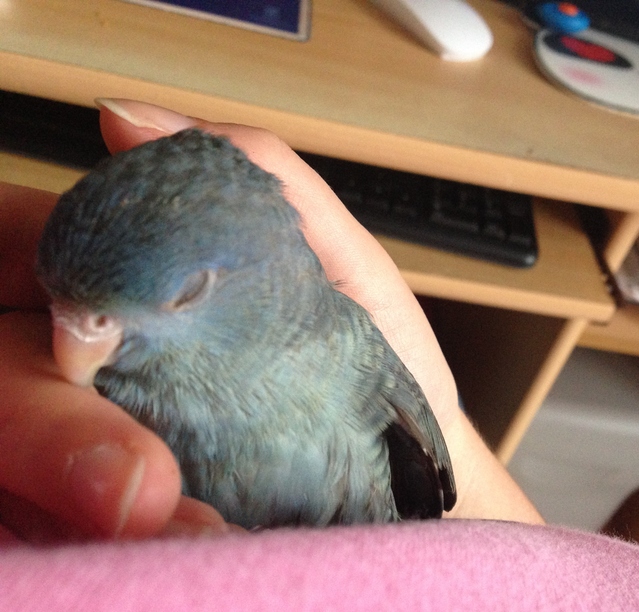
Where is `mouse`? The image size is (639, 612). mouse is located at coordinates (459, 31).